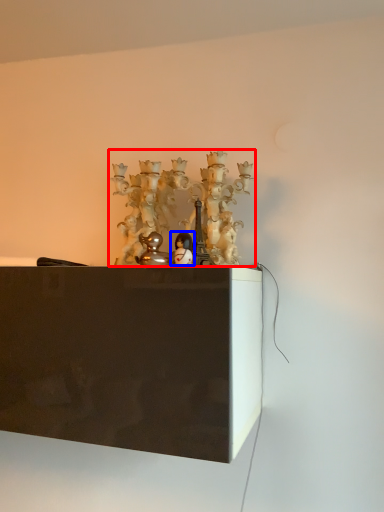
Question: Which of the following is the closest to the observer, art (highlighted by a red box) or toy (highlighted by a blue box)?

Choices:
 (A) art
 (B) toy

Answer: (B)